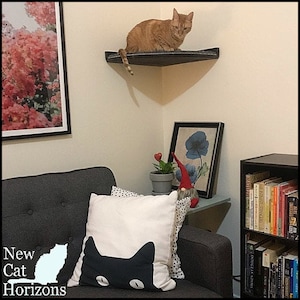
Find the location of `cat picture on pillow`. cat picture on pillow is located at coordinates (118, 274).